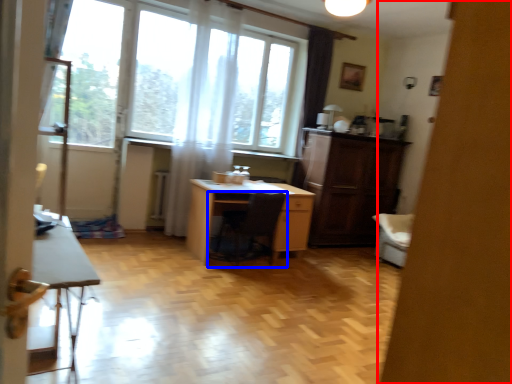
Question: Which object is closer to the camera taking this photo, screen door (highlighted by a red box) or chair (highlighted by a blue box)?

Choices:
 (A) screen door
 (B) chair

Answer: (A)